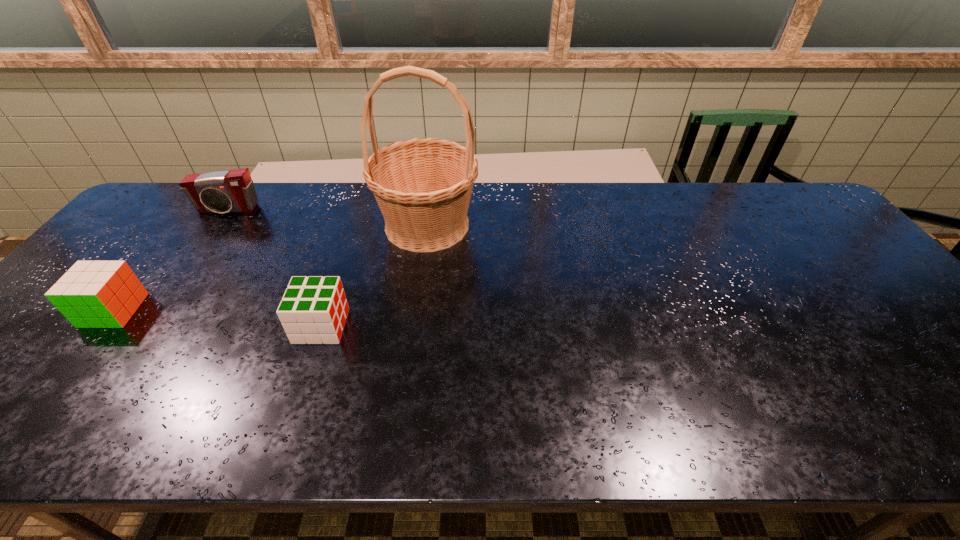
You are a GUI agent. You are given a task and a screenshot of the screen. Output one action in this format:
    pyautogui.click(x=<x>, y=<y>)
    Task: Click on the empty space that is in between the basket and the third object from left to right
    
    Given the screenshot: What is the action you would take?
    pyautogui.click(x=374, y=275)

Find the location of a particular element. free spot between the left cube and the rightmost object is located at coordinates (271, 268).

Identify the location of free area in between the third object from left to right and the left cube. This screenshot has width=960, height=540. (218, 318).

The height and width of the screenshot is (540, 960). Find the location of `free space between the camera and the rightmost object`. free space between the camera and the rightmost object is located at coordinates (327, 218).

Where is `empty space between the left cube and the third object from left to right`? empty space between the left cube and the third object from left to right is located at coordinates (218, 318).

Identify the location of unoccupied area between the camera and the left cube. This screenshot has height=540, width=960. (171, 260).

The height and width of the screenshot is (540, 960). Find the location of `empty space between the camera and the tallest object`. empty space between the camera and the tallest object is located at coordinates (327, 218).

Locate which object is the third closest to the right cube. Please provide its 2D coordinates. Your answer should be formatted as a tuple, i.e. [(x, y)], where the tuple contains the x and y coordinates of a point satisfying the conditions above.

[(229, 191)]

Locate an element on the screen. The height and width of the screenshot is (540, 960). object that stands as the closest to the left cube is located at coordinates (229, 191).

Image resolution: width=960 pixels, height=540 pixels. I want to click on blank area in the image that satisfies the following two spatial constraints: 1. on the front-facing side of the tallest object; 2. on the left side of the camera, so click(x=217, y=225).